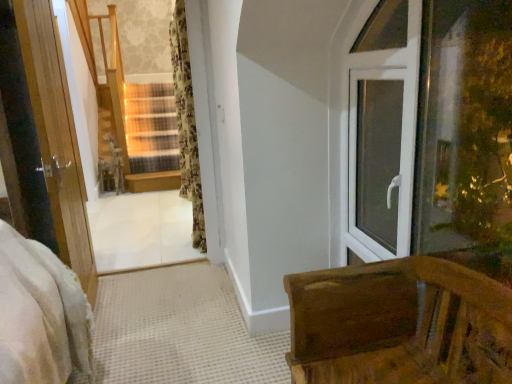
Question: From a real-world perspective, is wooden bench at lower right physically located above or below floral fabric curtain at center?

Choices:
 (A) below
 (B) above

Answer: (A)

Question: Looking at their shapes, would you say wooden bench at lower right is wider or thinner than floral fabric curtain at center?

Choices:
 (A) wide
 (B) thin

Answer: (A)

Question: Estimate the real-world distances between objects in this image. Which object is farther from the floral fabric curtain at center?

Choices:
 (A) wooden bench at lower right
 (B) wooden at center
 (C) white plastic window at right

Answer: (A)

Question: Which of these objects is positioned closest to the white plastic window at right?

Choices:
 (A) wooden bench at lower right
 (B) floral fabric curtain at center
 (C) wooden at center

Answer: (A)